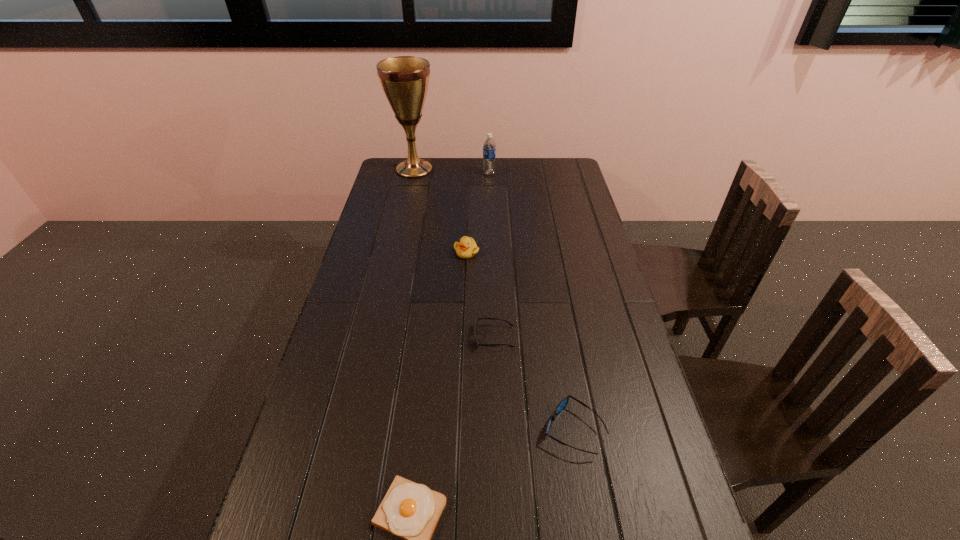
You are a GUI agent. You are given a task and a screenshot of the screen. Output one action in this format:
    pyautogui.click(x=<x>, y=<y>)
    Task: Click on the empty space between the water bottle and the third shortest object
    This screenshot has width=960, height=540.
    Given the screenshot: What is the action you would take?
    pyautogui.click(x=532, y=301)

Locate which object is the second closest to the second tallest object. Please provide its 2D coordinates. Your answer should be formatted as a tuple, i.e. [(x, y)], where the tuple contains the x and y coordinates of a point satisfying the conditions above.

[(466, 248)]

Where is `object that is the third closest to the rightmost object`? object that is the third closest to the rightmost object is located at coordinates (466, 248).